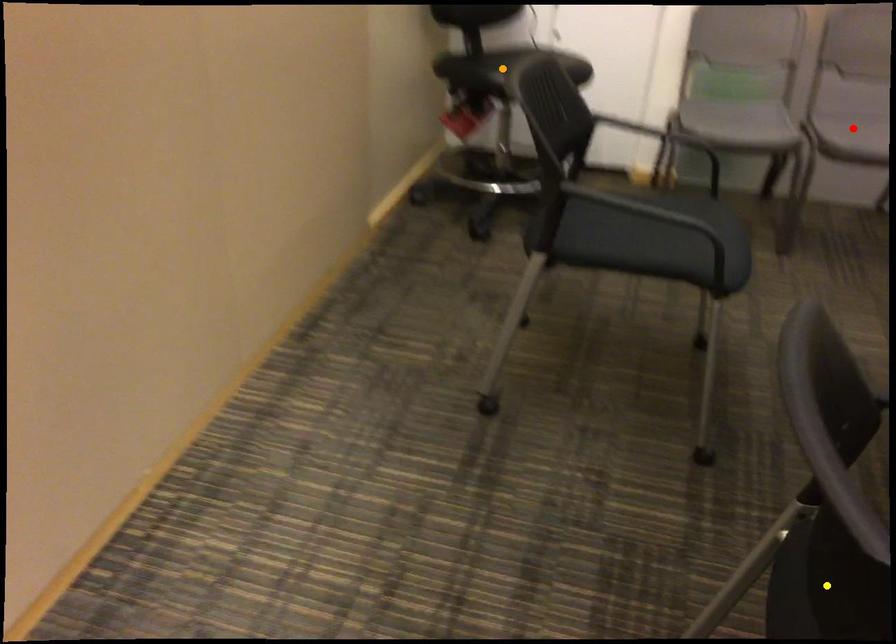
Order these from nearest to farthest:
red point | orange point | yellow point

1. yellow point
2. red point
3. orange point